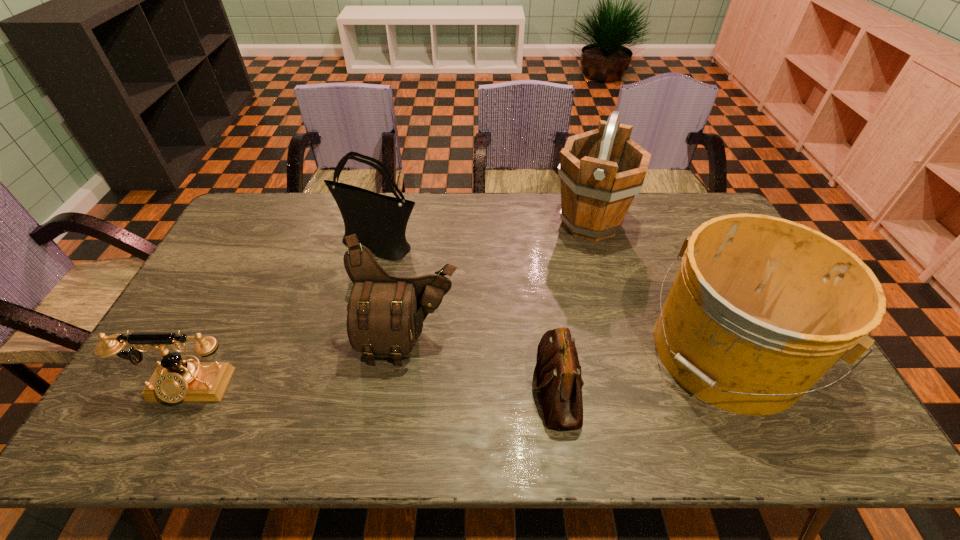
You are a GUI agent. You are given a task and a screenshot of the screen. Output one action in this format:
    pyautogui.click(x=<x>, y=<y>)
    Task: Click on the vacant region located on the left of the shortest shoulder bag
    The image size is (960, 540).
    Given the screenshot: What is the action you would take?
    pyautogui.click(x=448, y=386)

You are a GUI agent. You are given a task and a screenshot of the screen. Output one action in this format:
    pyautogui.click(x=<x>, y=<y>)
    Task: Click on the bucket located at the far edge
    
    Given the screenshot: What is the action you would take?
    pyautogui.click(x=601, y=171)

The height and width of the screenshot is (540, 960). Find the location of `shoulder bag that is at the far edge`. shoulder bag that is at the far edge is located at coordinates (379, 221).

This screenshot has height=540, width=960. I want to click on bucket located at the near edge, so click(x=761, y=308).

What are the coordinates of `shoulder bag present at the near edge` in the screenshot? It's located at (557, 374).

Identify the location of object at the left edge. (175, 380).

You are a GUI agent. You are given a task and a screenshot of the screen. Output one action in this format:
    pyautogui.click(x=<x>, y=<y>)
    Task: Click on the object that is at the right edge
    The width and height of the screenshot is (960, 540).
    Given the screenshot: What is the action you would take?
    pyautogui.click(x=761, y=308)

Find the location of `object that is positioned at the near right corner`. object that is positioned at the near right corner is located at coordinates (761, 308).

Where is `vacant area at the far edge`? vacant area at the far edge is located at coordinates (335, 223).

Locate an element on the screen. This screenshot has width=960, height=540. free point at the near edge is located at coordinates (199, 422).